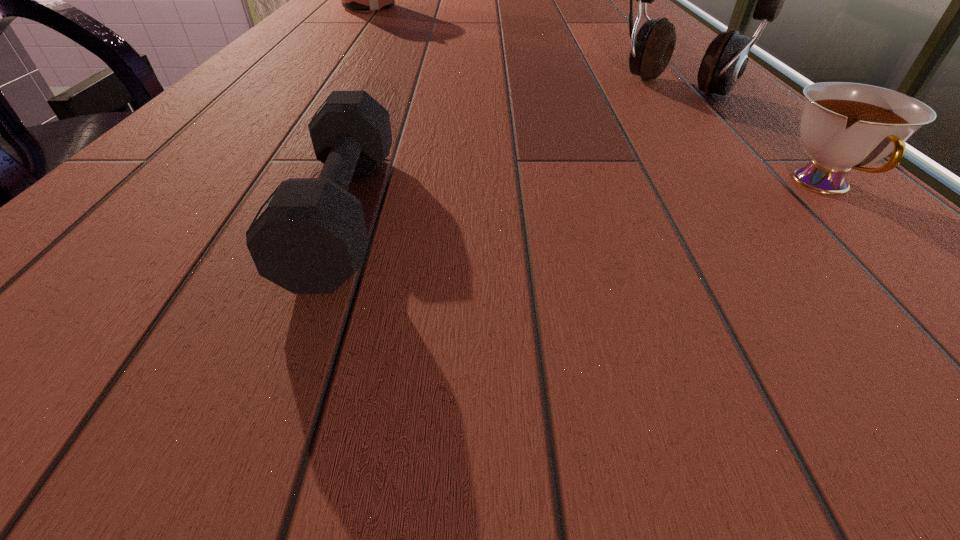
This screenshot has height=540, width=960. Find the location of `vacant space at the far edge`. vacant space at the far edge is located at coordinates (537, 6).

Locate an element on the screen. vacant space at the left edge of the desktop is located at coordinates (114, 200).

Locate an element on the screen. vacant space at the right edge of the desktop is located at coordinates (612, 46).

Locate an element on the screen. vacant space at the near right corner of the desktop is located at coordinates (779, 274).

This screenshot has height=540, width=960. Find the location of `vacant area that lies between the earphone and the teacup`. vacant area that lies between the earphone and the teacup is located at coordinates tap(751, 137).

Find the location of a particular element. The width and height of the screenshot is (960, 540). free spot between the teacup and the dumbbell is located at coordinates (584, 199).

The image size is (960, 540). Find the location of `free space between the second object from left to right and the teacup`. free space between the second object from left to right and the teacup is located at coordinates (584, 199).

What are the coordinates of `free area in between the dumbbell and the earphone` in the screenshot? It's located at (511, 150).

Find the location of a particular element. empty location between the second tallest object and the earphone is located at coordinates (523, 48).

Identify the location of unoccupied position between the earphone and the leftmost object. The width and height of the screenshot is (960, 540). (523, 48).